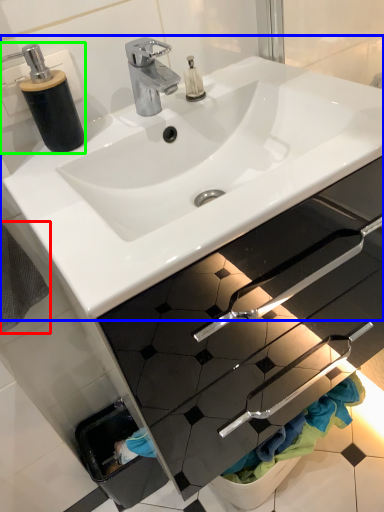
Question: Considering the real-world distances, which object is closest to bath towel (highlighted by a red box)? sink (highlighted by a blue box) or soap dispenser (highlighted by a green box).

Choices:
 (A) sink
 (B) soap dispenser

Answer: (B)